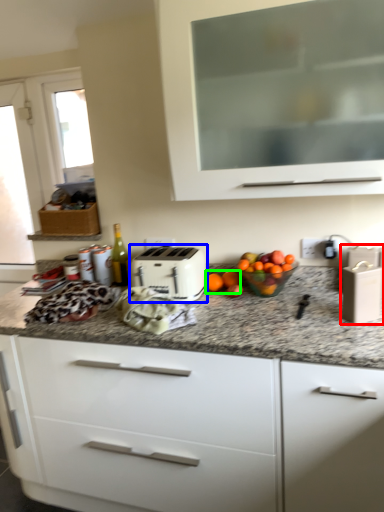
Question: Estimate the real-world distances between objects in this image. Which object is closer to appliance (highlighted by a red box), toaster (highlighted by a blue box) or citrus fruit (highlighted by a green box)?

Choices:
 (A) toaster
 (B) citrus fruit

Answer: (B)